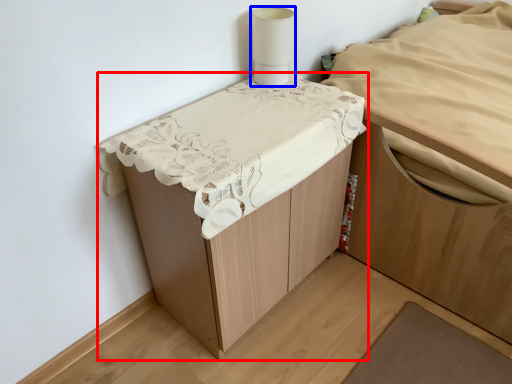
Question: Which of the following is the farthest to the observer, furniture (highlighted by a red box) or lamp (highlighted by a blue box)?

Choices:
 (A) furniture
 (B) lamp

Answer: (B)